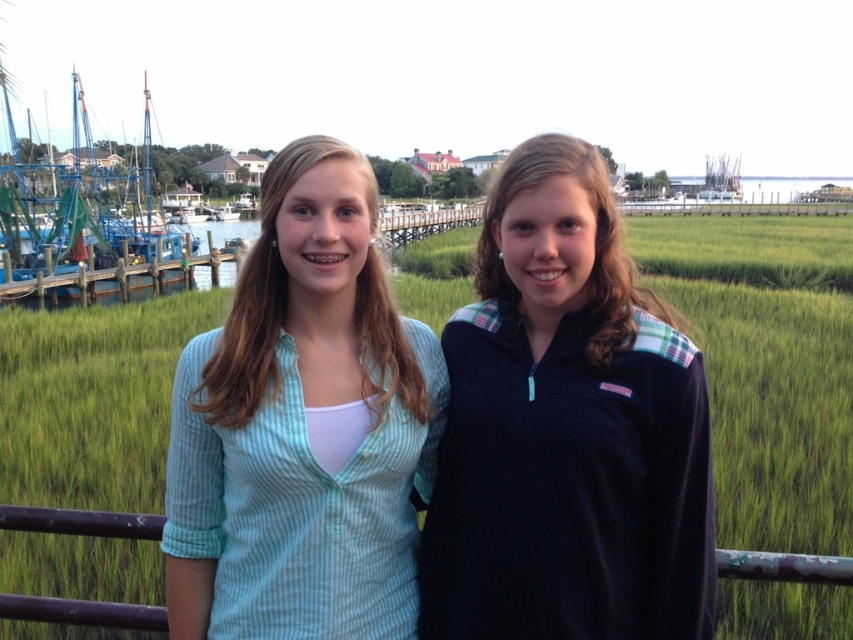
Which is behind, point (177, 554) or point (131, 516)?

The point (177, 554) is more distant.

Where is `light blue striped shirt at center`? light blue striped shirt at center is located at coordinates (303, 428).

Is green grass at center to the left of brown wooden fence at lower center from the viewer's perspective?

In fact, green grass at center is to the right of brown wooden fence at lower center.

Between green grass at center and brown wooden fence at lower center, which one is positioned lower?

Positioned lower is brown wooden fence at lower center.

Where is `green grass at center`? green grass at center is located at coordinates (767, 365).

Is green grass at center to the right of blue painted wooden boat at left from the viewer's perspective?

Correct, you'll find green grass at center to the right of blue painted wooden boat at left.

Can you confirm if green grass at center is positioned below blue painted wooden boat at left?

Yes.

Between point (743, 600) and point (6, 236), which one is positioned behind?

Point (6, 236)

I want to click on green grass at center, so click(767, 365).